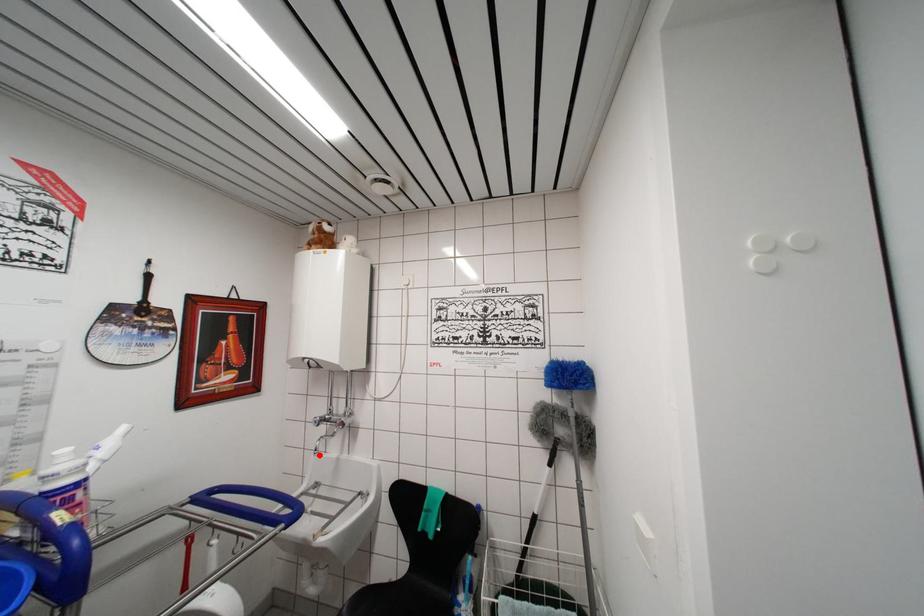
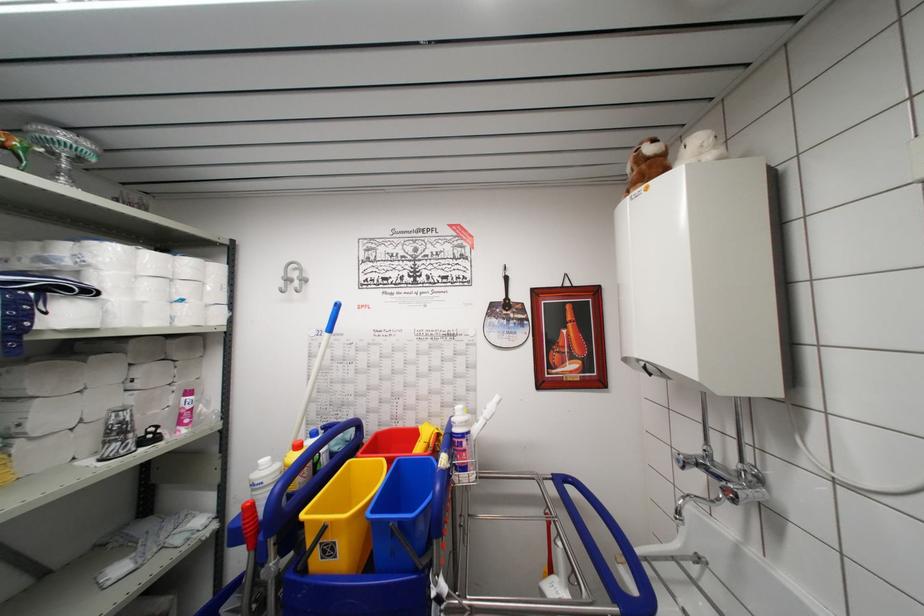
Find the pixel in the second image that matches the highlighted location in the first image.

(681, 517)